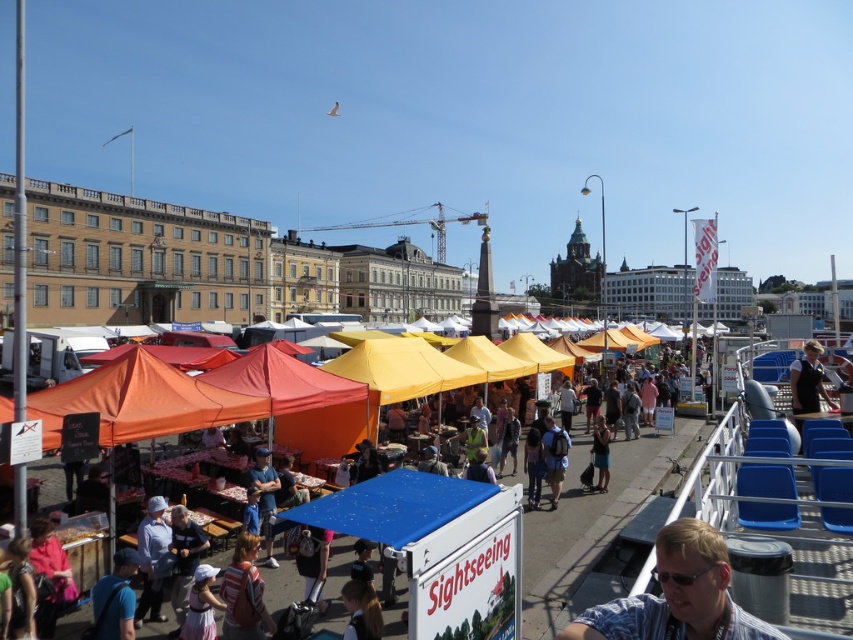
Can you confirm if dark blue uniform at center is wider than light brown hair at lower center?

Indeed, dark blue uniform at center has a greater width compared to light brown hair at lower center.

In the scene shown: Measure the distance from dark blue uniform at center to light brown hair at lower center.

dark blue uniform at center is 126.98 feet from light brown hair at lower center.

This screenshot has width=853, height=640. I want to click on dark blue uniform at center, so click(x=807, y=380).

Who is higher up, blue printed shirt at center or light brown hair at lower center?

Positioned higher is blue printed shirt at center.

The image size is (853, 640). Describe the element at coordinates (677, 595) in the screenshot. I see `blue printed shirt at center` at that location.

Is point (665, 596) positioned in front of point (355, 625)?

Yes, it is.

Where is `blue printed shirt at center`? blue printed shirt at center is located at coordinates (677, 595).

Does blue printed shirt at center have a smaller size compared to light brown leather backpack at lower center?

Actually, blue printed shirt at center might be larger than light brown leather backpack at lower center.

Which is behind, point (689, 620) or point (250, 570)?

The point (250, 570) is behind.

What do you see at coordinates (677, 595) in the screenshot? I see `blue printed shirt at center` at bounding box center [677, 595].

Find the location of a particular element. This screenshot has height=640, width=853. blue printed shirt at center is located at coordinates (677, 595).